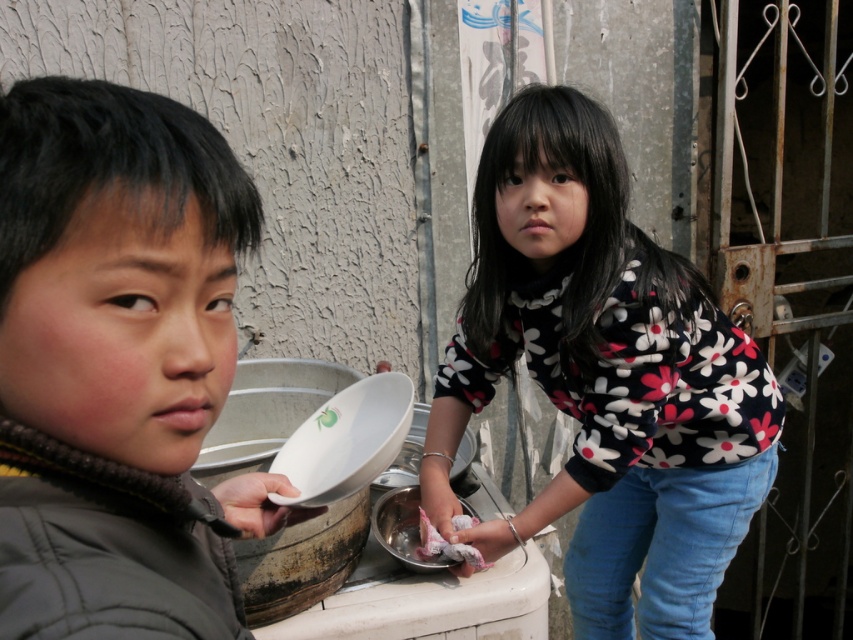
From the picture: You are a photographer standing at a certain distance from the scene. You want to capture a closeup shot of the white glossy plate at center. Based on the description, what is the minimum distance you need to be from the plate to get a clear closeup?

The white glossy plate at center is 3.44 feet away from the camera, so the photographer needs to be at least 3.44 feet away to capture a clear closeup.

You are a photographer trying to capture the white glossy plate at center in the image. Based on the coordinates provided in the Objects Description, can you determine if the plate is positioned closer to the top or bottom of the image?

The white glossy plate at center is located at point (346, 440). Since the y coordinate is 0.407, which is closer to 0.5, the center of the image, it is positioned closer to the center rather than the top or bottom. However, since 0.407 is slightly below the center, it is closer to the bottom half of the image.